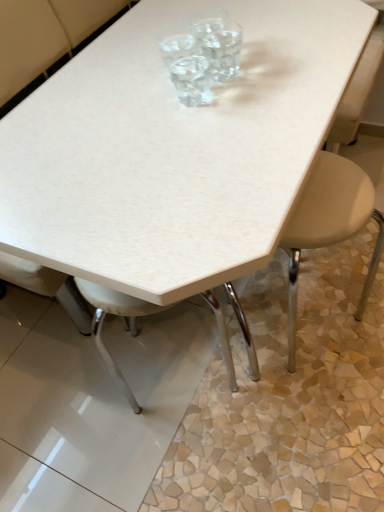
This screenshot has height=512, width=384. Identify the location of beige plastic chair at lower right. (329, 225).

This screenshot has width=384, height=512. Describe the element at coordinates (329, 225) in the screenshot. I see `beige plastic chair at lower right` at that location.

At what (x,y) coordinates should I click in order to perform the action: click on beige plastic chair at lower right. Please return your answer as a coordinate pair (x, y). The width and height of the screenshot is (384, 512). Looking at the image, I should click on (329, 225).